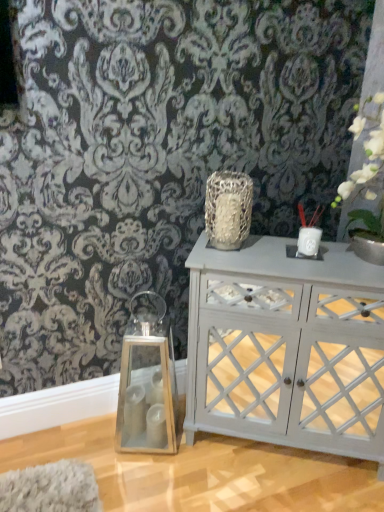
The image size is (384, 512). Find the location of `vacant space in front of white ceramic vase at upper right, the third candle holder positioned from the left`. vacant space in front of white ceramic vase at upper right, the third candle holder positioned from the left is located at coordinates (314, 267).